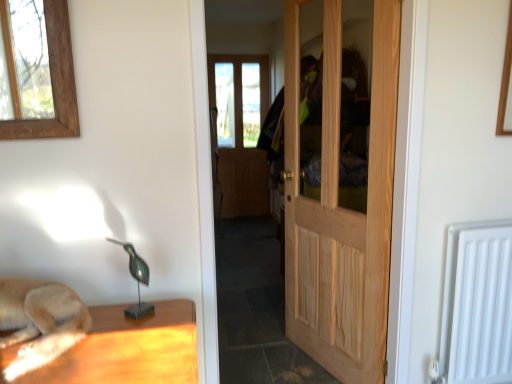
Question: Could you tell me if natural wood door at center is facing green metallic bird at center?

Choices:
 (A) yes
 (B) no

Answer: (A)

Question: Is natural wood door at center taller than green metallic bird at center?

Choices:
 (A) no
 (B) yes

Answer: (B)

Question: Is natural wood door at center beside green metallic bird at center?

Choices:
 (A) no
 (B) yes

Answer: (A)

Question: Is natural wood door at center turned away from green metallic bird at center?

Choices:
 (A) no
 (B) yes

Answer: (A)

Question: Is natural wood door at center to the right of green metallic bird at center from the viewer's perspective?

Choices:
 (A) no
 (B) yes

Answer: (B)

Question: From a real-world perspective, is natural wood door at center under green metallic bird at center?

Choices:
 (A) no
 (B) yes

Answer: (A)

Question: Is natural wood door at center a part of green metallic bird at center?

Choices:
 (A) yes
 (B) no

Answer: (B)

Question: Is green metallic bird at center looking in the opposite direction of natural wood door at center?

Choices:
 (A) yes
 (B) no

Answer: (B)

Question: Is green metallic bird at center next to natural wood door at center and touching it?

Choices:
 (A) yes
 (B) no

Answer: (B)

Question: Is green metallic bird at center outside natural wood door at center?

Choices:
 (A) yes
 (B) no

Answer: (A)

Question: Can you confirm if green metallic bird at center is bigger than natural wood door at center?

Choices:
 (A) no
 (B) yes

Answer: (A)

Question: Does green metallic bird at center have a lesser height compared to natural wood door at center?

Choices:
 (A) no
 (B) yes

Answer: (B)

Question: Is white matte radiator at lower right at the back of green metallic bird at center?

Choices:
 (A) yes
 (B) no

Answer: (B)